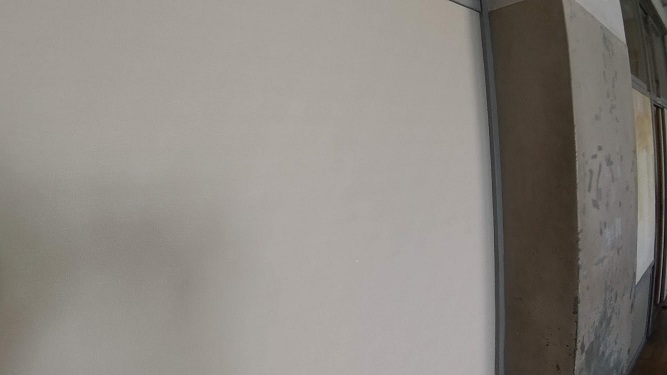
The height and width of the screenshot is (375, 667). Find the location of `cork board`. cork board is located at coordinates (646, 208).